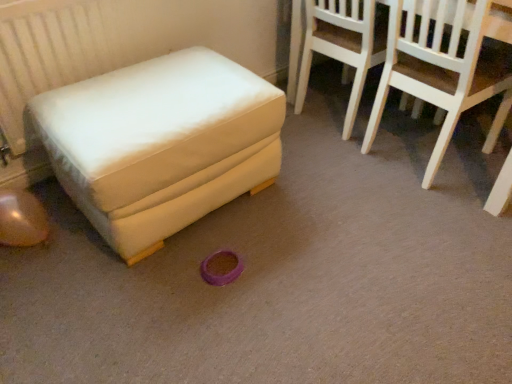
Question: Is light wood chair at upper right, the 2th chair in the right-to-left sequence, looking in the opposite direction of white fabric ottoman at left?

Choices:
 (A) yes
 (B) no

Answer: (A)

Question: From a real-world perspective, is light wood chair at upper right, positioned as the first chair in left-to-right order, located higher than white fabric ottoman at left?

Choices:
 (A) no
 (B) yes

Answer: (B)

Question: From the image's perspective, does light wood chair at upper right, the 2th chair in the right-to-left sequence, appear lower than white fabric ottoman at left?

Choices:
 (A) no
 (B) yes

Answer: (A)

Question: Is white fabric ottoman at left located within light wood chair at upper right, the 2th chair in the right-to-left sequence?

Choices:
 (A) no
 (B) yes

Answer: (A)

Question: From a real-world perspective, is light wood chair at upper right, the 2th chair in the right-to-left sequence, under white fabric ottoman at left?

Choices:
 (A) yes
 (B) no

Answer: (B)

Question: Considering the relative sizes of light wood chair at upper right, the 2th chair in the right-to-left sequence, and white fabric ottoman at left in the image provided, is light wood chair at upper right, the 2th chair in the right-to-left sequence, bigger than white fabric ottoman at left?

Choices:
 (A) no
 (B) yes

Answer: (A)

Question: Can you confirm if white wood chair at upper right, the second chair from the left, is thinner than white fabric ottoman at left?

Choices:
 (A) no
 (B) yes

Answer: (B)

Question: Can you confirm if white wood chair at upper right, acting as the first chair starting from the right, is shorter than white fabric ottoman at left?

Choices:
 (A) yes
 (B) no

Answer: (B)

Question: Is the position of white wood chair at upper right, the second chair from the left, less distant than that of white fabric ottoman at left?

Choices:
 (A) no
 (B) yes

Answer: (A)

Question: Can you confirm if white wood chair at upper right, the second chair from the left, is bigger than white fabric ottoman at left?

Choices:
 (A) no
 (B) yes

Answer: (A)

Question: Is white wood chair at upper right, acting as the first chair starting from the right, to the left of white fabric ottoman at left from the viewer's perspective?

Choices:
 (A) no
 (B) yes

Answer: (A)

Question: Could you tell me if white wood chair at upper right, the second chair from the left, is turned towards white fabric ottoman at left?

Choices:
 (A) yes
 (B) no

Answer: (B)

Question: From a real-world perspective, is white fabric ottoman at left physically above white wood chair at upper right, the second chair from the left?

Choices:
 (A) no
 (B) yes

Answer: (A)